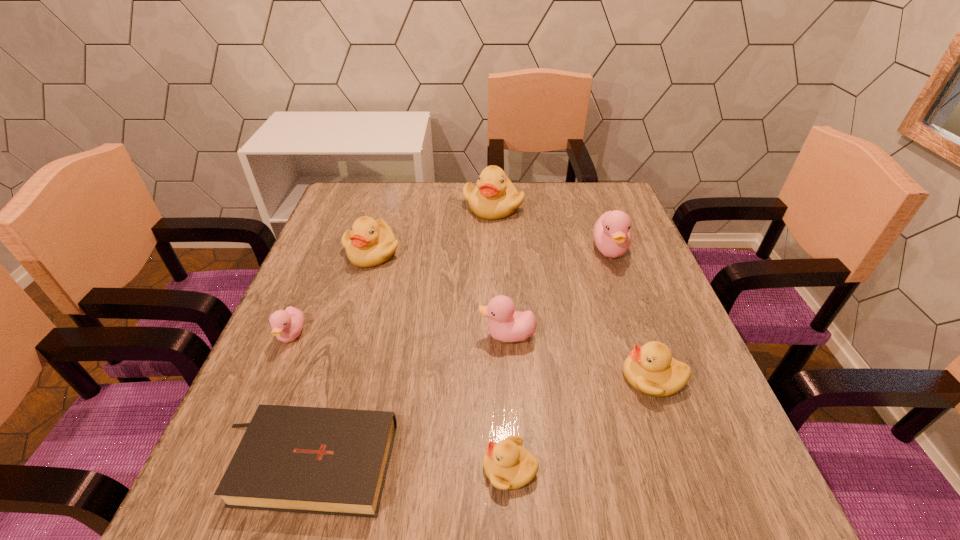
This screenshot has height=540, width=960. Find the location of `the farthest object`. the farthest object is located at coordinates (495, 197).

Identify the location of the farthest duckling. The image size is (960, 540). 495,197.

Where is `the biggest pink duckling`? the biggest pink duckling is located at coordinates (612, 235).

This screenshot has height=540, width=960. In order to click on the rightmost pink duckling in this screenshot , I will do `click(612, 235)`.

Identify the location of the second farthest yellow duckling. (369, 243).

At what (x,y) coordinates should I click in order to perform the action: click on the second biggest yellow duckling. Please return your answer as a coordinate pair (x, y). Image resolution: width=960 pixels, height=540 pixels. Looking at the image, I should click on (369, 243).

This screenshot has height=540, width=960. I want to click on the second pink duckling from left to right, so click(507, 325).

Find the location of a particular element. The image size is (960, 540). the sixth farthest duckling is located at coordinates (651, 369).

Locate an element on the screen. The image size is (960, 540). the second nearest yellow duckling is located at coordinates (651, 369).

What are the coordinates of `the leftmost pink duckling` in the screenshot? It's located at (286, 325).